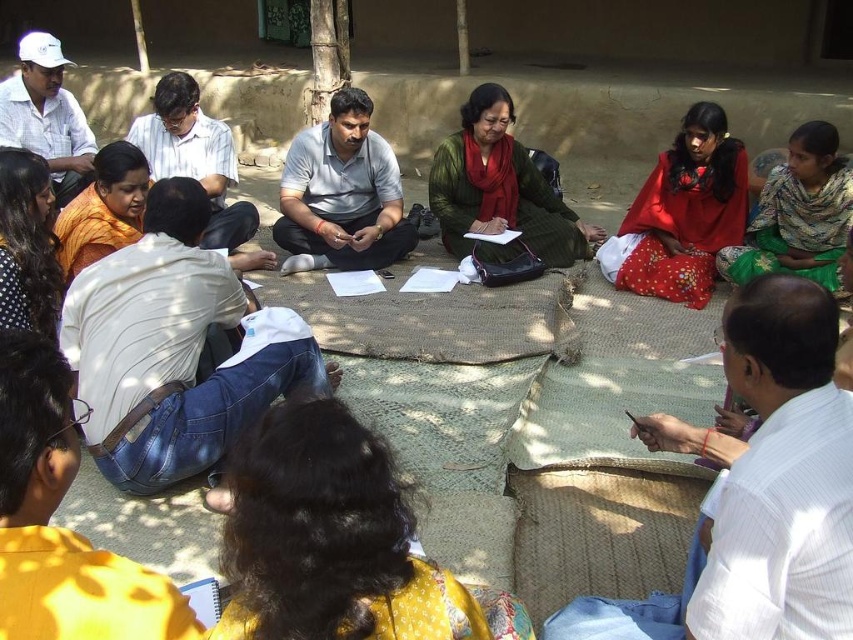
You are a photographer standing behind the group of people. You want to take a photo that includes both the light gray cotton shirt at center and the green woolen sweater at center. What is the minimum distance you need to step back to ensure both are fully visible in the frame?

The minimum distance you need to step back to ensure both the light gray cotton shirt at center and the green woolen sweater at center are fully visible in the frame is 25.10 inches.

You are a photographer standing in the scene and want to take a closeup shot of the dark brown hair at lower center. The camera you are using has a minimum focusing distance of 38 inches. Can you take the photo without moving closer?

The dark brown hair at lower center and viewer are 39.14 inches apart from each other. Since the minimum focusing distance is 38 inches, the photographer cannot take the photo without moving closer because the distance is slightly beyond the camera limit.